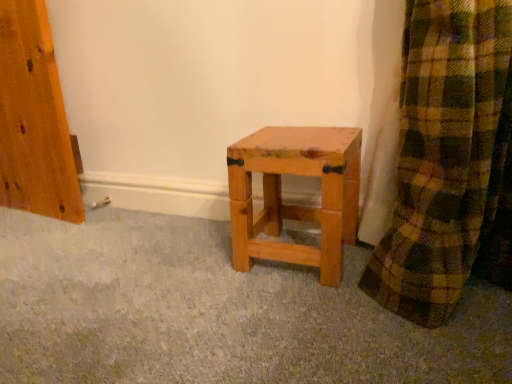
Question: Would you say natural wood stool at center is inside or outside natural wood stool at center?

Choices:
 (A) inside
 (B) outside

Answer: (B)

Question: Looking at the image, does natural wood stool at center seem bigger or smaller compared to natural wood stool at center?

Choices:
 (A) small
 (B) big

Answer: (A)

Question: From a real-world perspective, is natural wood stool at center positioned above or below natural wood stool at center?

Choices:
 (A) above
 (B) below

Answer: (A)

Question: In terms of size, does natural wood stool at center appear bigger or smaller than natural wood stool at center?

Choices:
 (A) small
 (B) big

Answer: (B)

Question: From their relative heights in the image, would you say natural wood stool at center is taller or shorter than natural wood stool at center?

Choices:
 (A) tall
 (B) short

Answer: (B)

Question: Is natural wood stool at center in front of or behind natural wood stool at center in the image?

Choices:
 (A) behind
 (B) front

Answer: (B)

Question: Looking at their shapes, would you say natural wood stool at center is wider or thinner than natural wood stool at center?

Choices:
 (A) wide
 (B) thin

Answer: (A)